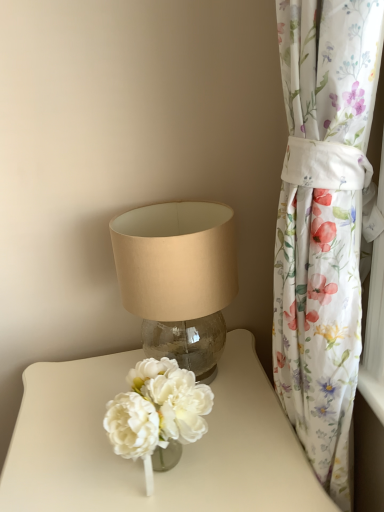
Question: Is translucent glass vase at center positioned with its back to floral fabric curtain at right?

Choices:
 (A) no
 (B) yes

Answer: (A)

Question: Considering the relative sizes of translucent glass vase at center and floral fabric curtain at right in the image provided, is translucent glass vase at center thinner than floral fabric curtain at right?

Choices:
 (A) yes
 (B) no

Answer: (B)

Question: Is floral fabric curtain at right completely or partially inside translucent glass vase at center?

Choices:
 (A) no
 (B) yes

Answer: (B)

Question: Is translucent glass vase at center located outside floral fabric curtain at right?

Choices:
 (A) yes
 (B) no

Answer: (A)

Question: Does translucent glass vase at center have a greater width compared to floral fabric curtain at right?

Choices:
 (A) yes
 (B) no

Answer: (A)

Question: Can you confirm if translucent glass vase at center is positioned to the right of floral fabric curtain at right?

Choices:
 (A) yes
 (B) no

Answer: (B)

Question: Is floral fabric curtain at right taller than translucent glass vase at center?

Choices:
 (A) no
 (B) yes

Answer: (B)

Question: Considering the relative positions of floral fabric curtain at right and translucent glass vase at center in the image provided, is floral fabric curtain at right to the right of translucent glass vase at center from the viewer's perspective?

Choices:
 (A) yes
 (B) no

Answer: (A)

Question: Is floral fabric curtain at right turned away from translucent glass vase at center?

Choices:
 (A) yes
 (B) no

Answer: (B)

Question: Does floral fabric curtain at right have a greater width compared to translucent glass vase at center?

Choices:
 (A) yes
 (B) no

Answer: (B)

Question: Does floral fabric curtain at right turn towards translucent glass vase at center?

Choices:
 (A) no
 (B) yes

Answer: (B)

Question: Can you confirm if floral fabric curtain at right is bigger than translucent glass vase at center?

Choices:
 (A) no
 (B) yes

Answer: (A)

Question: Does beige fabric lampshade at center have a greater width compared to floral fabric curtain at right?

Choices:
 (A) yes
 (B) no

Answer: (A)